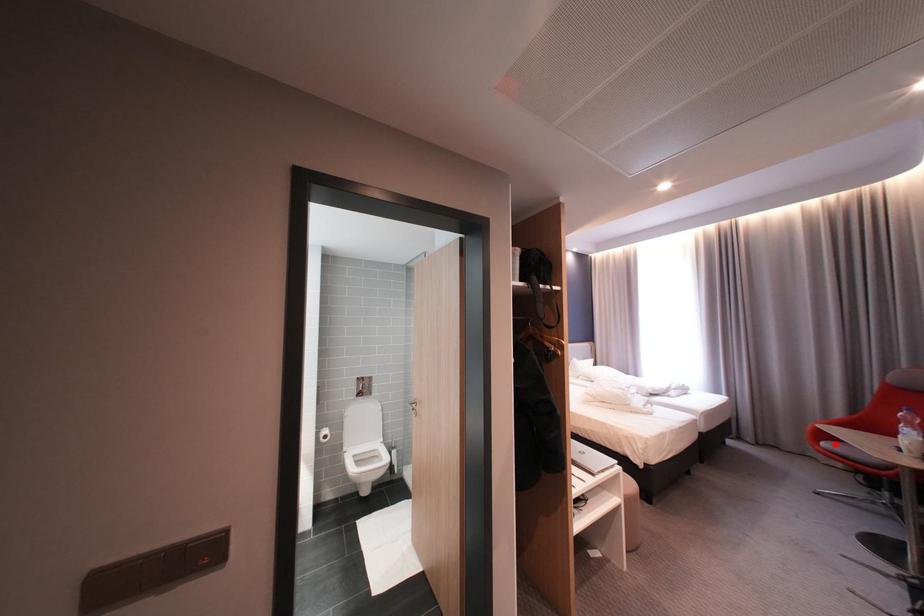
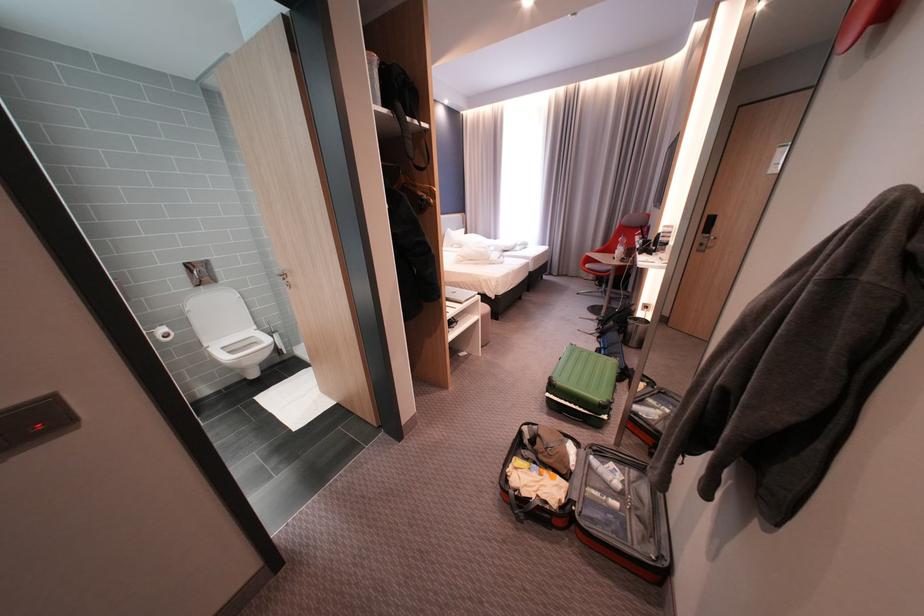
Question: I am providing you with two images of the same scene from different viewpoints. Image1 has a red point marked. In image2, the corresponding 3D location appears at what relative position? Reply with the corresponding letter.

Choices:
 (A) Closer
 (B) Farther

Answer: (A)